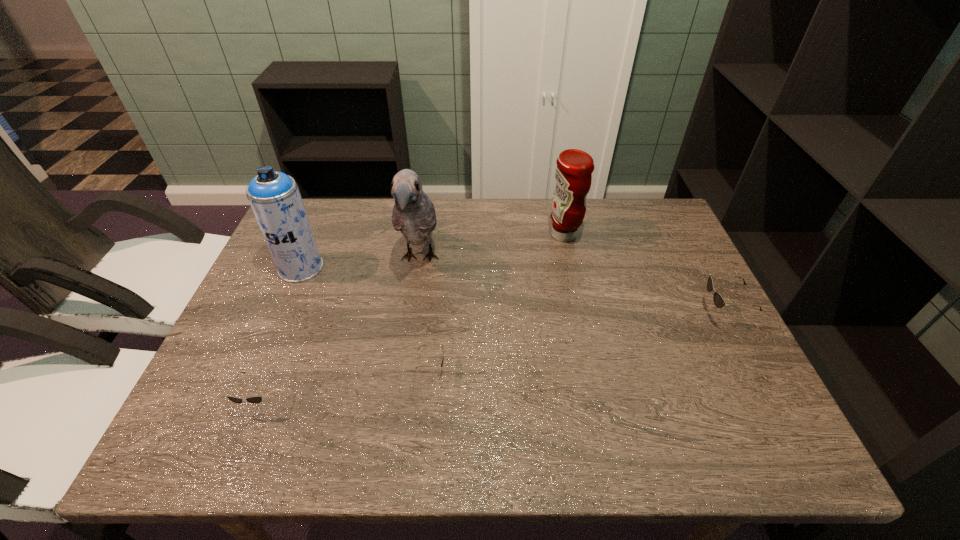
This screenshot has height=540, width=960. In order to click on free space between the condiment and the aerosol can in this screenshot , I will do `click(432, 252)`.

Locate an element on the screen. free space that is in between the second shortest sunglasses and the parrot is located at coordinates (340, 329).

Locate an element on the screen. vacant space in between the aerosol can and the leftmost sunglasses is located at coordinates (281, 334).

At what (x,y) coordinates should I click in order to perform the action: click on free space that is in between the second sunglasses from right to left and the parrot. Please return your answer as a coordinate pair (x, y). Looking at the image, I should click on (425, 314).

Where is `free spot between the parrot and the aerosol can`? This screenshot has width=960, height=540. free spot between the parrot and the aerosol can is located at coordinates point(360,263).

Locate an element on the screen. vacant area that lies between the parrot and the leftmost sunglasses is located at coordinates (340, 329).

Locate an element on the screen. This screenshot has height=540, width=960. empty space between the parrot and the fifth object from left to right is located at coordinates (492, 247).

Locate an element on the screen. Image resolution: width=960 pixels, height=540 pixels. free spot between the second sunglasses from left to right and the rightmost sunglasses is located at coordinates point(577,342).

You are a GUI agent. You are given a task and a screenshot of the screen. Output one action in this format:
    pyautogui.click(x=<x>, y=<y>)
    Task: Click on the empty location between the fourth tallest object and the aerosol can
    The image size is (960, 540).
    Given the screenshot: What is the action you would take?
    pyautogui.click(x=511, y=292)

Locate an element on the screen. This screenshot has height=540, width=960. free spot between the tallest sunglasses and the condiment is located at coordinates [x=642, y=275].